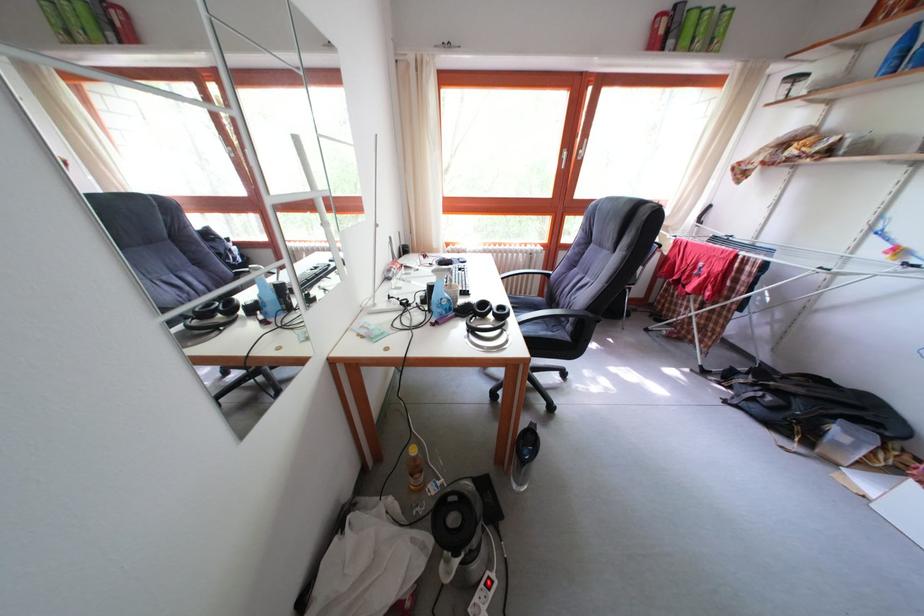
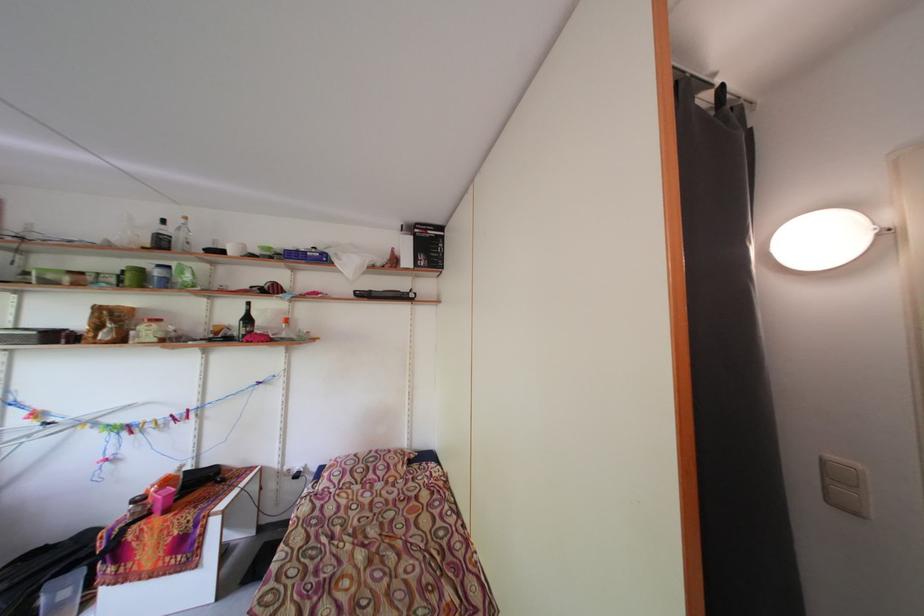
Question: The first image is from the beginning of the video and the second image is from the end. How did the camera likely rotate when shooting the video?

Choices:
 (A) Left
 (B) Right
 (C) Up
 (D) Down

Answer: (B)